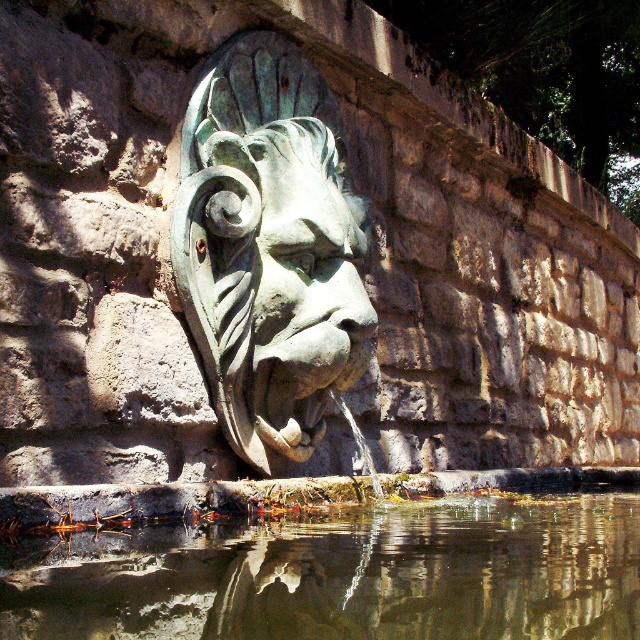
In the scene shown: You are standing in front of a stone wall with two sculptures. You see a green patina stone lion head at center and a green patina stone face at center. Which sculpture is positioned to the left?

The green patina stone lion head at center is positioned to the left of the green patina stone face at center.

In the scene shown: You are standing in front of the stone wall with the lion head sculpture. You want to find the clear water at lower center. Where exactly should you look?

You should look at point (342, 573) to find the clear water at lower center.

You are a maintenance worker tasked with cleaning the clear water at lower center and the green patina stone face at center. You have a 3 meter long hose. Can you reach both areas with the hose without moving it?

The clear water at lower center and green patina stone face at center are 3.32 meters apart. Since the hose is only 3 meters long, it is not long enough to reach both areas without moving it.